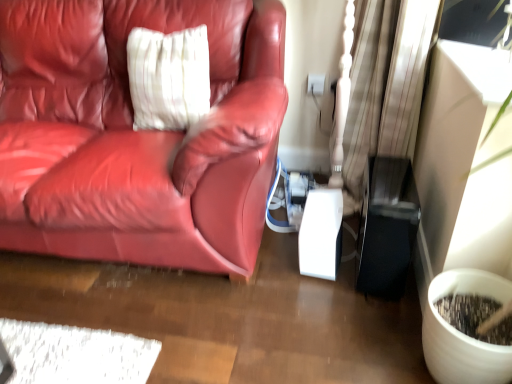
This screenshot has width=512, height=384. What do you see at coordinates (168, 77) in the screenshot?
I see `white striped pillow at upper left` at bounding box center [168, 77].

I want to click on white striped pillow at upper left, so click(168, 77).

This screenshot has height=384, width=512. What are the coordinates of `white striped pillow at upper left` in the screenshot? It's located at (168, 77).